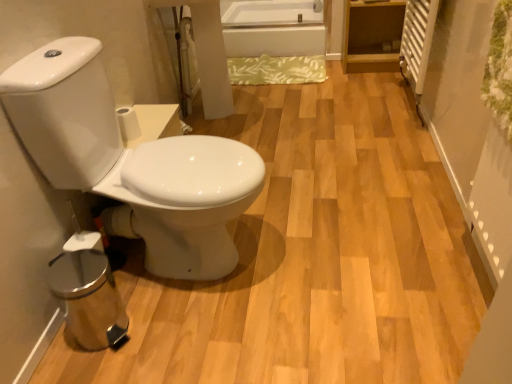
Measure the distance between white glossy bathtub at upper center and camera.

white glossy bathtub at upper center and camera are 3.11 meters apart from each other.

This screenshot has width=512, height=384. Find the location of `white glossy bathtub at upper center`. white glossy bathtub at upper center is located at coordinates (272, 28).

Consider the image. From a real-world perspective, relative to white glossy bathtub at upper center, is white matte toilet paper at center vertically above or below?

white matte toilet paper at center is above white glossy bathtub at upper center.

Is white matte toilet paper at center facing towards white glossy bathtub at upper center?

No.

Considering the relative sizes of white matte toilet paper at center and white glossy bathtub at upper center in the image provided, is white matte toilet paper at center bigger than white glossy bathtub at upper center?

No.

Who is shorter, white matte toilet paper at center or white glossy bathtub at upper center?

Standing shorter between the two is white matte toilet paper at center.

Find the location of a particular element. toilet located below the white matte toilet paper at center (from the image's perspective) is located at coordinates (131, 162).

Would you consider white matte toilet paper at center to be distant from white glossy toilet at left?

No, there isn't a large distance between white matte toilet paper at center and white glossy toilet at left.

Consider the image. Relative to white glossy toilet at left, is white matte toilet paper at center in front or behind?

white matte toilet paper at center is positioned farther from the viewer than white glossy toilet at left.

From the image's perspective, which is above, white matte toilet paper at center or white glossy toilet at left?

white matte toilet paper at center.

Is white glossy toilet at left beside white matte toilet paper at center?

No, white glossy toilet at left is not making contact with white matte toilet paper at center.

Is white glossy toilet at left oriented towards white matte toilet paper at center?

No, white glossy toilet at left is not facing towards white matte toilet paper at center.

Between point (153, 226) and point (132, 133), which one is positioned in front?

Point (153, 226)

This screenshot has height=384, width=512. Identify the location of toilet paper above the white glossy toilet at left (from the image's perspective). (128, 123).

Based on the photo, which is behind, white glossy bathtub at upper center or white matte toilet paper at center?

Positioned behind is white glossy bathtub at upper center.

Is white glossy bathtub at upper center facing towards white matte toilet paper at center?

Yes, white glossy bathtub at upper center is aimed at white matte toilet paper at center.

From the image's perspective, does white glossy bathtub at upper center appear higher than white matte toilet paper at center?

Correct, white glossy bathtub at upper center appears higher than white matte toilet paper at center in the image.

Considering the sizes of objects white glossy bathtub at upper center and white matte toilet paper at center in the image provided, who is taller, white glossy bathtub at upper center or white matte toilet paper at center?

white glossy bathtub at upper center is taller.

Considering the relative positions of white glossy toilet at left and white glossy bathtub at upper center in the image provided, is white glossy toilet at left in front of white glossy bathtub at upper center?

Yes, white glossy toilet at left is in front of white glossy bathtub at upper center.

Considering the relative sizes of white glossy toilet at left and white glossy bathtub at upper center in the image provided, is white glossy toilet at left taller than white glossy bathtub at upper center?

Yes.

Is white glossy toilet at left beside white glossy bathtub at upper center?

No, white glossy toilet at left is not touching white glossy bathtub at upper center.

In the scene shown: From a real-world perspective, is white glossy bathtub at upper center on top of white glossy toilet at left?

No, from a real-world perspective, white glossy bathtub at upper center is not over white glossy toilet at left

Can you confirm if white glossy bathtub at upper center is thinner than white glossy toilet at left?

No.

From the image's perspective, relative to white glossy toilet at left, is white glossy bathtub at upper center above or below?

From the image's perspective, white glossy bathtub at upper center appears above white glossy toilet at left.

The width and height of the screenshot is (512, 384). Identify the location of bath directly beneath the white matte toilet paper at center (from a real-world perspective). (272, 28).

This screenshot has width=512, height=384. Identify the location of toilet paper above the white glossy toilet at left (from the image's perspective). (128, 123).

Estimate the real-world distances between objects in this image. Which object is further from white glossy toilet at left, white glossy bathtub at upper center or white matte toilet paper at center?

white glossy bathtub at upper center lies further to white glossy toilet at left than the other object.

Looking at the image, which one is located closer to white matte toilet paper at center, white glossy toilet at left or white glossy bathtub at upper center?

white glossy toilet at left lies closer to white matte toilet paper at center than the other object.

From the image, which object appears to be nearer to white glossy bathtub at upper center, white matte toilet paper at center or white glossy toilet at left?

The object closer to white glossy bathtub at upper center is white matte toilet paper at center.

When comparing their distances from white glossy bathtub at upper center, does white glossy toilet at left or white matte toilet paper at center seem closer?

white matte toilet paper at center is closer to white glossy bathtub at upper center.

Which object lies further to the anchor point white matte toilet paper at center, white glossy bathtub at upper center or white glossy toilet at left?

white glossy bathtub at upper center.

Estimate the real-world distances between objects in this image. Which object is further from white glossy toilet at left, white matte toilet paper at center or white glossy bathtub at upper center?

white glossy bathtub at upper center is positioned further to the anchor white glossy toilet at left.

The width and height of the screenshot is (512, 384). What are the coordinates of `toilet paper positioned between white glossy toilet at left and white glossy bathtub at upper center from near to far` in the screenshot? It's located at (128, 123).